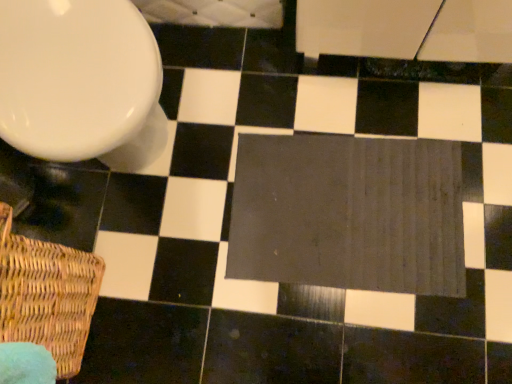
Where is `vacant region below dark gray fabric bath mat at center (from a real-world perspective)`? This screenshot has height=384, width=512. vacant region below dark gray fabric bath mat at center (from a real-world perspective) is located at coordinates (344, 213).